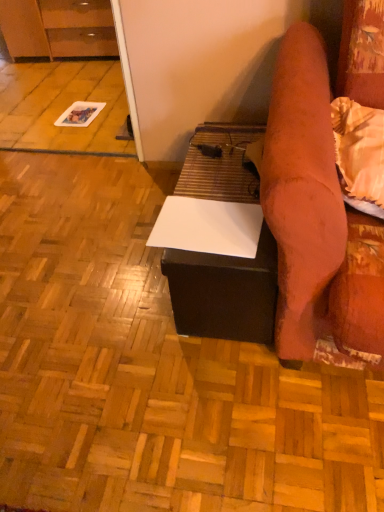
Identify the location of free space to the left of white matte table at center. The height and width of the screenshot is (512, 384). (91, 283).